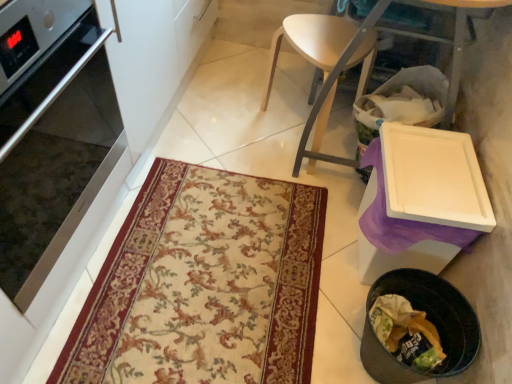
Where is `vacant area that lies between satin silver oven at left and white plastic cutting board at right`? vacant area that lies between satin silver oven at left and white plastic cutting board at right is located at coordinates tap(219, 193).